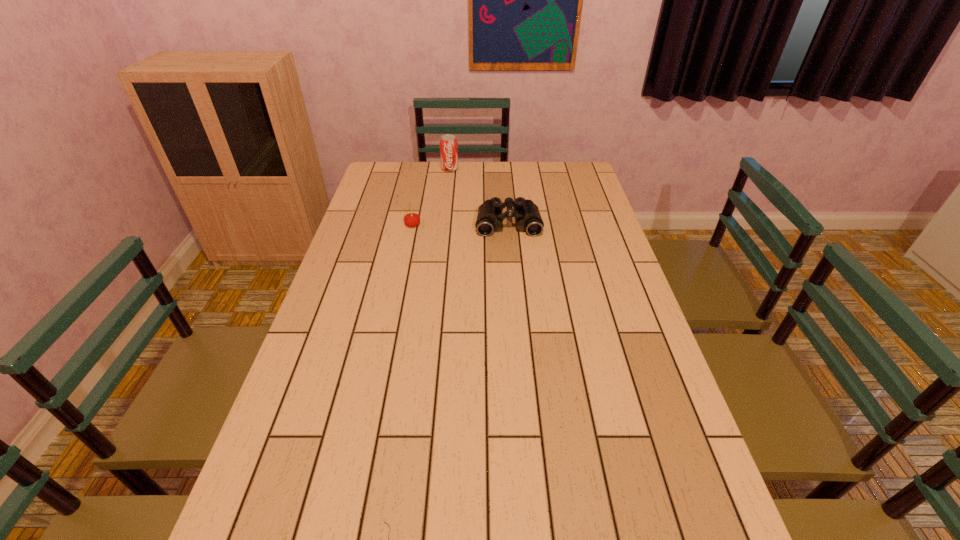
I want to click on free region at the right edge, so click(x=697, y=510).

Where is `blank region between the rightmost object and the farthest object`? blank region between the rightmost object and the farthest object is located at coordinates (479, 196).

Where is `free spot between the rightmost object and the soda can`? This screenshot has height=540, width=960. free spot between the rightmost object and the soda can is located at coordinates (479, 196).

Locate an element on the screen. This screenshot has width=960, height=540. vacant region between the cherry and the farthest object is located at coordinates (431, 197).

Locate an element on the screen. The height and width of the screenshot is (540, 960). empty space between the leftmost object and the binoculars is located at coordinates (461, 224).

Where is `free spot between the binoculars and the soda can`? This screenshot has height=540, width=960. free spot between the binoculars and the soda can is located at coordinates (479, 196).

Where is `free space between the cherry and the rightmost object`? The height and width of the screenshot is (540, 960). free space between the cherry and the rightmost object is located at coordinates (461, 224).

Select which object appears as the third closest to the mouse. Please provide its 2D coordinates. Your answer should be formatted as a tuple, i.e. [(x, y)], where the tuple contains the x and y coordinates of a point satisfying the conditions above.

[(448, 143)]

In order to click on the third closest object relative to the farthest object in this screenshot , I will do `click(384, 522)`.